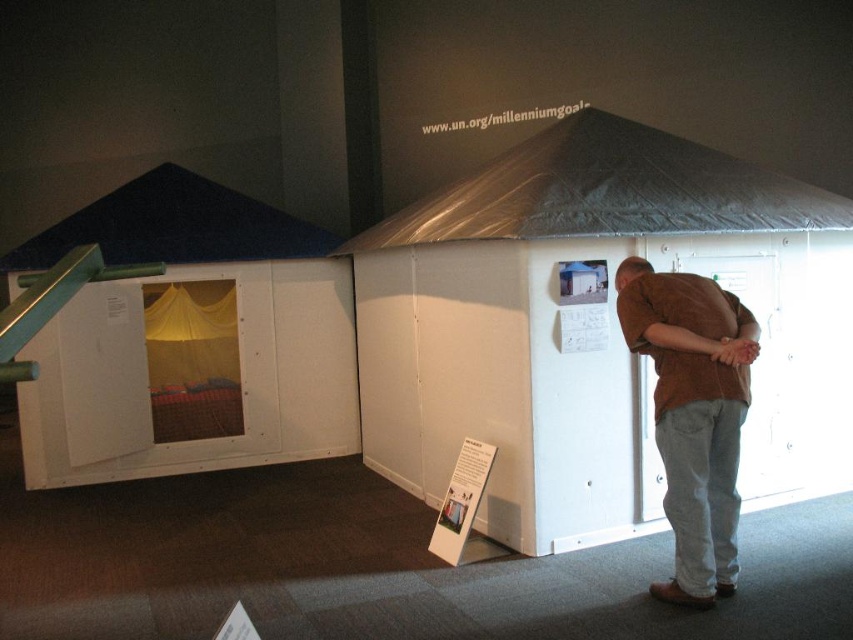
Question: Which point is closer to the camera?

Choices:
 (A) white matte tent at left
 (B) white matte tent at center
 (C) dark blue fabric canopy at upper left

Answer: (B)

Question: Is white matte tent at left above dark blue fabric canopy at upper left?

Choices:
 (A) no
 (B) yes

Answer: (A)

Question: Can you confirm if white matte tent at center is positioned above white matte tent at left?

Choices:
 (A) yes
 (B) no

Answer: (A)

Question: Where is white matte tent at left located in relation to dark blue fabric canopy at upper left in the image?

Choices:
 (A) above
 (B) below

Answer: (B)

Question: Which point is closer to the camera taking this photo?

Choices:
 (A) (567, 138)
 (B) (119, 241)

Answer: (A)

Question: Which of the following is the farthest from the observer?

Choices:
 (A) transparent plastic canopy at upper center
 (B) dark blue fabric canopy at upper left
 (C) white matte tent at left

Answer: (B)